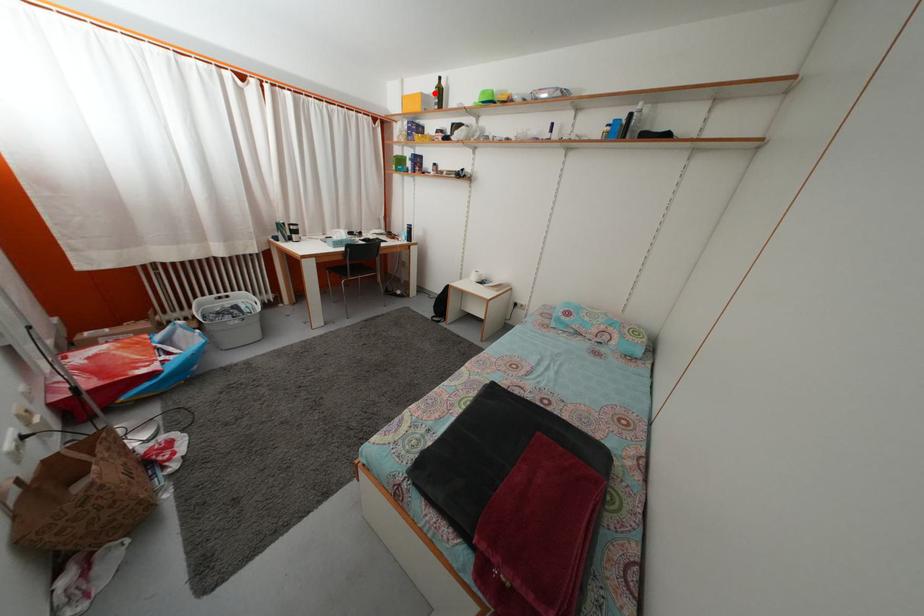
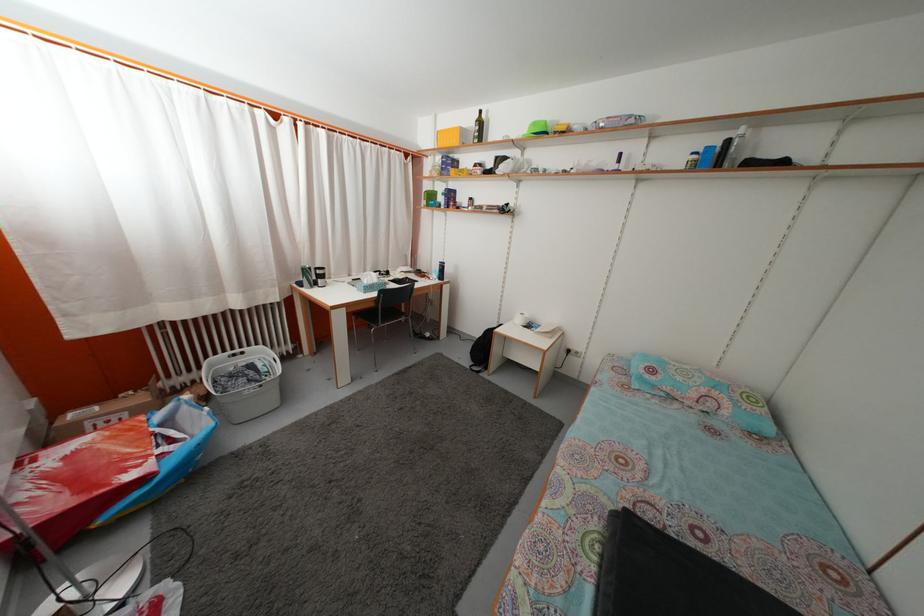
Where in the second image is the point corresponding to the highlighted location from the first image?

(475, 127)